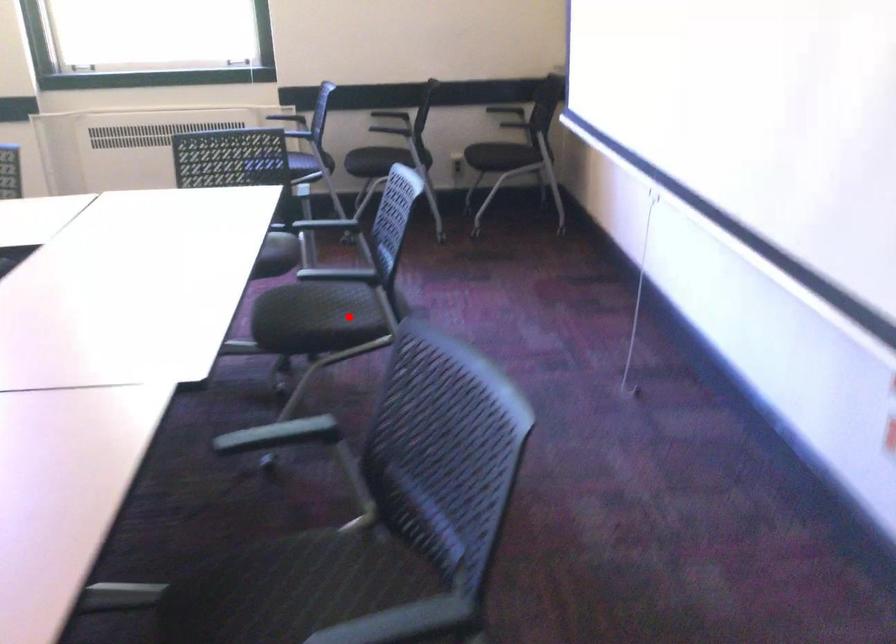
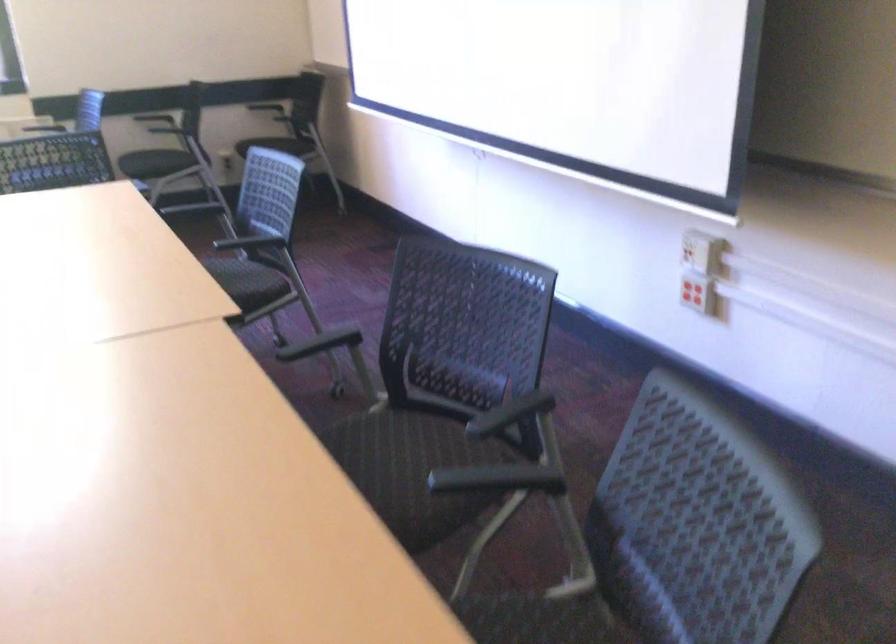
Question: I am providing you with two images of the same scene from different viewpoints. In image1, a red point is highlighted. Considering the same 3D point in image2, which of the following is correct?

Choices:
 (A) It is closer
 (B) It is farther

Answer: (B)